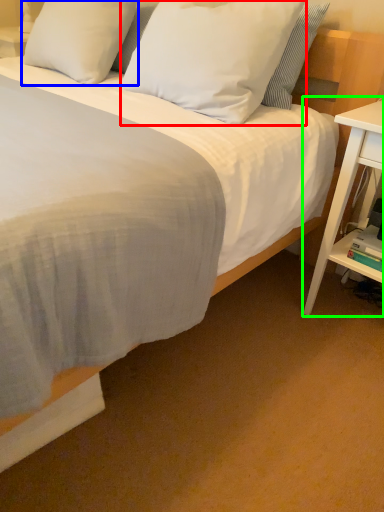
Question: Which is nearer to the pillow (highlighted by a red box)? pillow (highlighted by a blue box) or nightstand (highlighted by a green box).

Choices:
 (A) pillow
 (B) nightstand

Answer: (A)